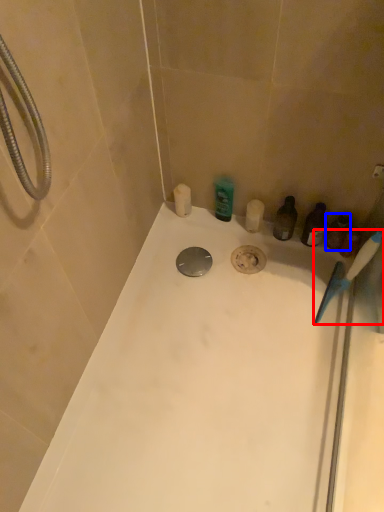
Question: Which of the following is the farthest to the observer, toothbrush (highlighted by a red box) or toiletry (highlighted by a blue box)?

Choices:
 (A) toothbrush
 (B) toiletry

Answer: (B)